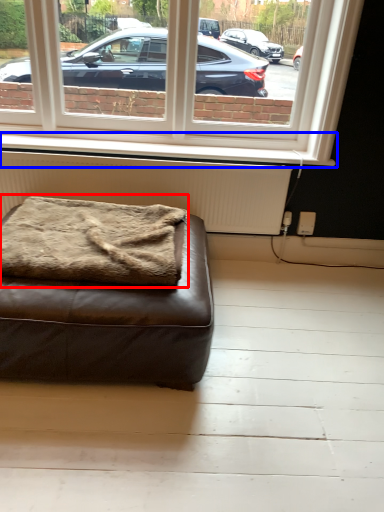
Question: Which of the following is the farthest to the observer, blanket (highlighted by a red box) or window sill (highlighted by a blue box)?

Choices:
 (A) blanket
 (B) window sill

Answer: (B)